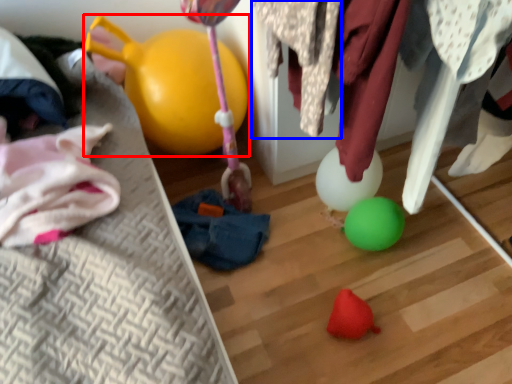
Question: Which of the following is the closest to the observer, balloon (highlighted by a red box) or clothing (highlighted by a blue box)?

Choices:
 (A) balloon
 (B) clothing

Answer: (B)